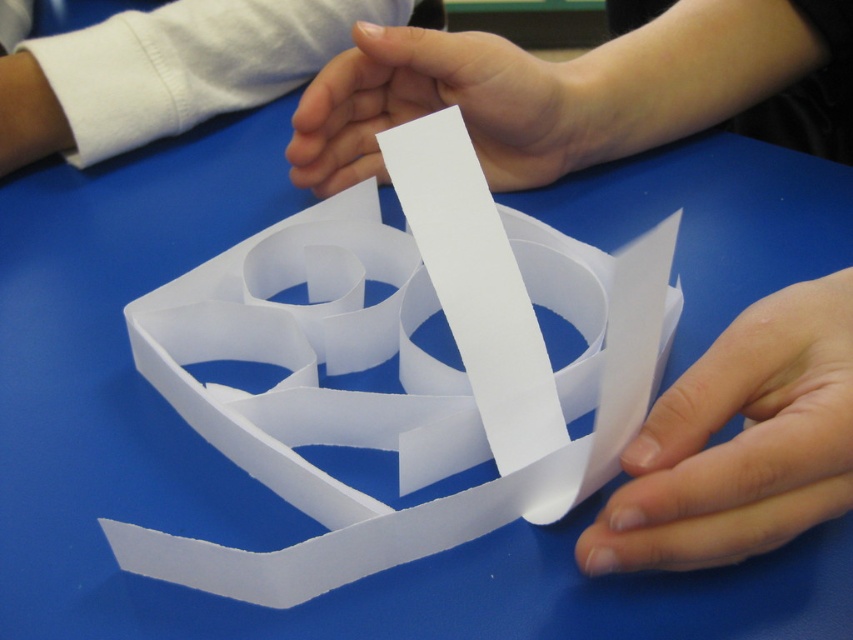
You are trying to reach a point on the paper craft structure with a tool that has a maximum reach of 24 inches. Can you reach the point at point (129, 45)?

The distance of point (129, 45) from viewer is 24.23 inches, so the tool cannot reach it since its maximum reach is 24 inches.

You are a craft instructor demonstrating a paper folding technique. Your hands are holding the white clothed arm at upper left and need to reach the white paper at center. Can you safely perform the demonstration without touching the table? The maximum reach distance your hands can extend without touching the table is 7 inches.

The white clothed arm at upper left is 7.49 inches away from the white paper at center. Since the maximum reach is 7 inches, the distance is slightly too far for the instructor to safely perform the demonstration without touching the table.